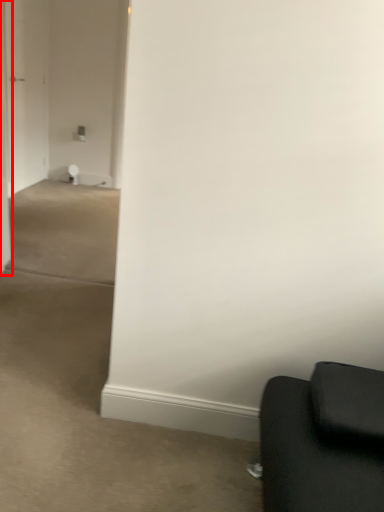
Question: Observing the image, what is the correct spatial positioning of door (annotated by the red box) in reference to glass door?

Choices:
 (A) right
 (B) left

Answer: (A)